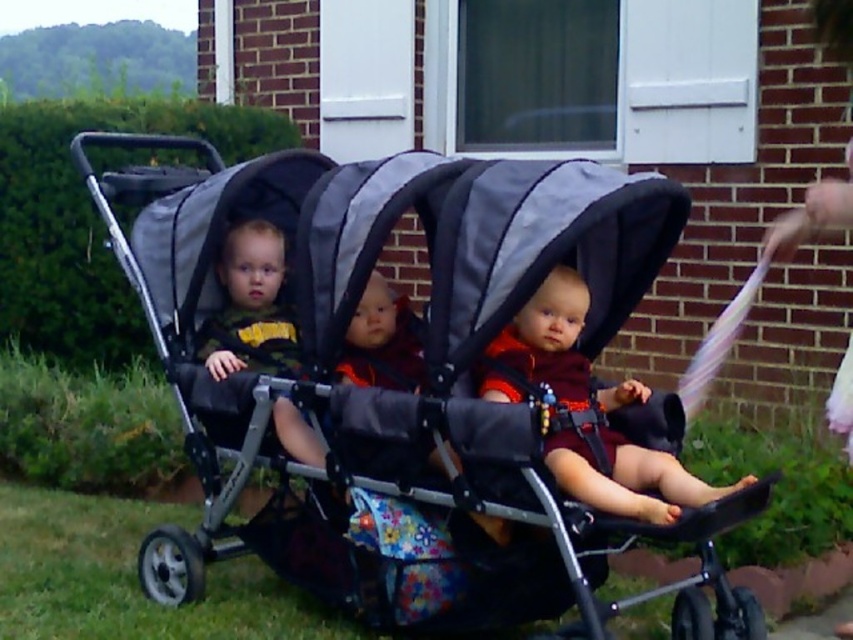
You are a parent trying to choose between two strollers for your child. You see the gray fabric stroller at center and the matte black stroller at center in a store. Based on the image, which stroller is taller?

The gray fabric stroller at center is taller than the matte black stroller at center according to the description.

You are a photographer standing at a certain distance from the gray fabric stroller at center. You want to take a photo that captures the stroller and the brick wall in the background clearly. Considering the typical focus range of a camera lens is 3 feet to infinity, will the stroller be in focus?

The gray fabric stroller at center is 4.49 feet from the camera, which falls within the focus range of 3 feet to infinity. Therefore, the stroller will be in focus.

You are a parent pushing the stroller and want to know which part of the stroller is on the left side. Which one is located to the left, the gray fabric stroller at center or the matte black stroller at center?

The gray fabric stroller at center is located to the left of the matte black stroller at center.